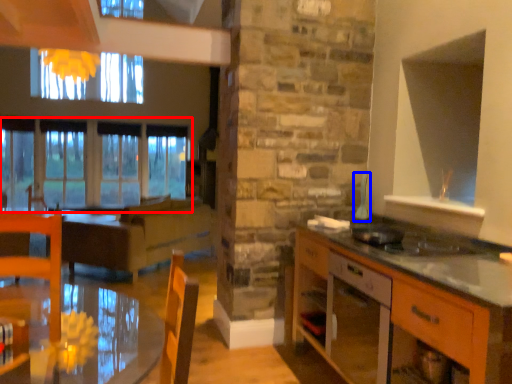
Question: Among these objects, which one is nearest to the camera, window (highlighted by a red box) or appliance (highlighted by a blue box)?

Choices:
 (A) window
 (B) appliance

Answer: (B)